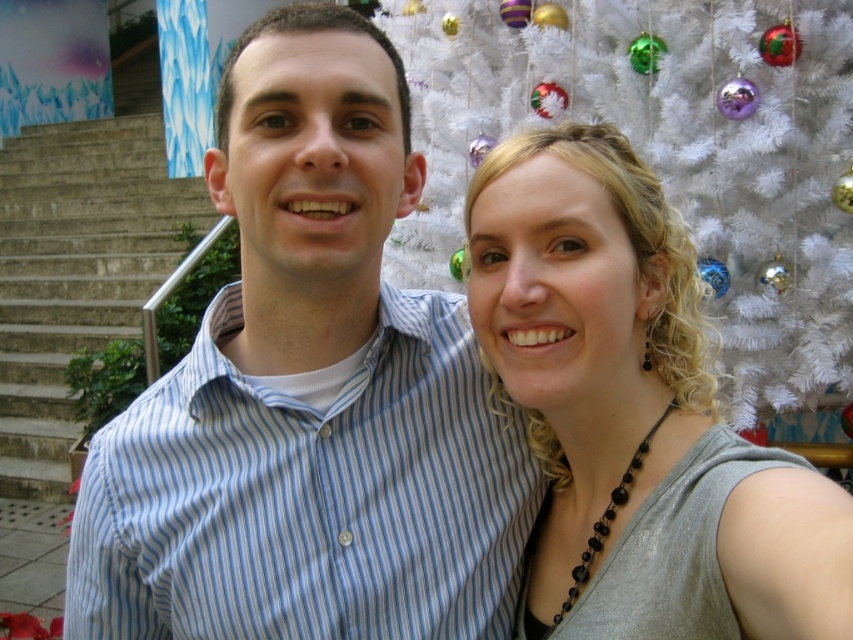
Question: Is blue striped shirt at center closer to camera compared to white artificial christmas tree at upper right?

Choices:
 (A) yes
 (B) no

Answer: (A)

Question: Does blue striped shirt at center appear over white artificial christmas tree at upper right?

Choices:
 (A) yes
 (B) no

Answer: (B)

Question: Which object is farther from the camera taking this photo?

Choices:
 (A) matte gray tank top at center
 (B) white artificial christmas tree at upper right
 (C) gray concrete stairs at left

Answer: (C)

Question: Which point is farther to the camera?

Choices:
 (A) gray concrete stairs at left
 (B) white artificial christmas tree at upper right

Answer: (A)

Question: Which object is the farthest from the gray concrete stairs at left?

Choices:
 (A) matte gray tank top at center
 (B) blue striped shirt at center

Answer: (A)

Question: From the image, what is the correct spatial relationship of blue striped shirt at center in relation to white artificial christmas tree at upper right?

Choices:
 (A) left
 (B) right

Answer: (A)